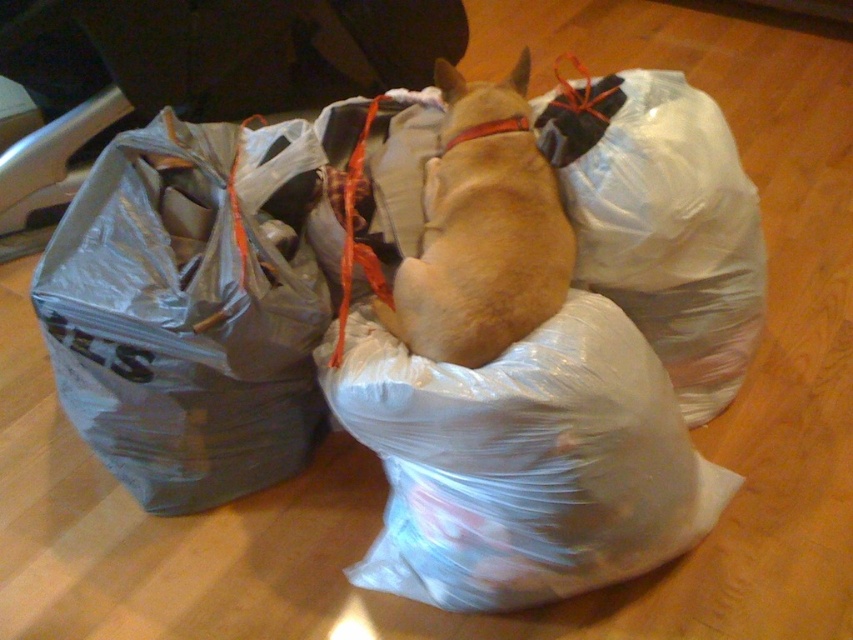
You are trying to decide which plastic bag to use to carry some groceries. The clear plastic bag at center and the gray plastic bag at left are available. Based on their sizes, which one can hold more items?

The clear plastic bag at center might be wider than gray plastic bag at left, so it can hold more items.

You are a pet owner who wants to ensure your dog is safe while resting. The dog is on a wooden floor surrounded by two large plastic garbage bags. Based on the scene, is the light brown fur at center resting on the transparent plastic bag at center or directly on the wooden floor?

The transparent plastic bag at center is positioned under light brown fur at center, so the dog is resting on the transparent plastic bag at center and not directly on the wooden floor.

From the picture: You are a delivery person who needs to place a package between the clear plastic bag at center and the gray plastic bag at left. Based on their positions, where should you place the package?

The clear plastic bag at center is in front of the gray plastic bag at left, so you should place the package behind the clear plastic bag at center and in front of the gray plastic bag at left to position it between them.